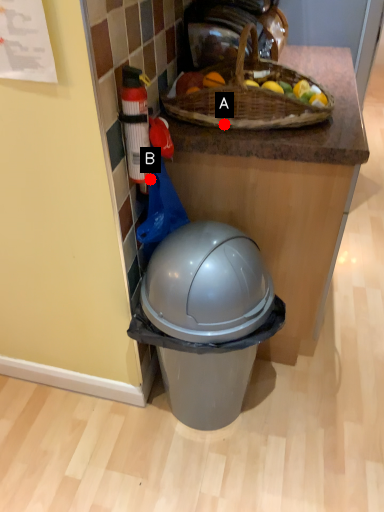
Question: Two points are circled on the image, labeled by A and B beside each circle. Which point appears closest to the camera in this image?

Choices:
 (A) A is closer
 (B) B is closer

Answer: (B)